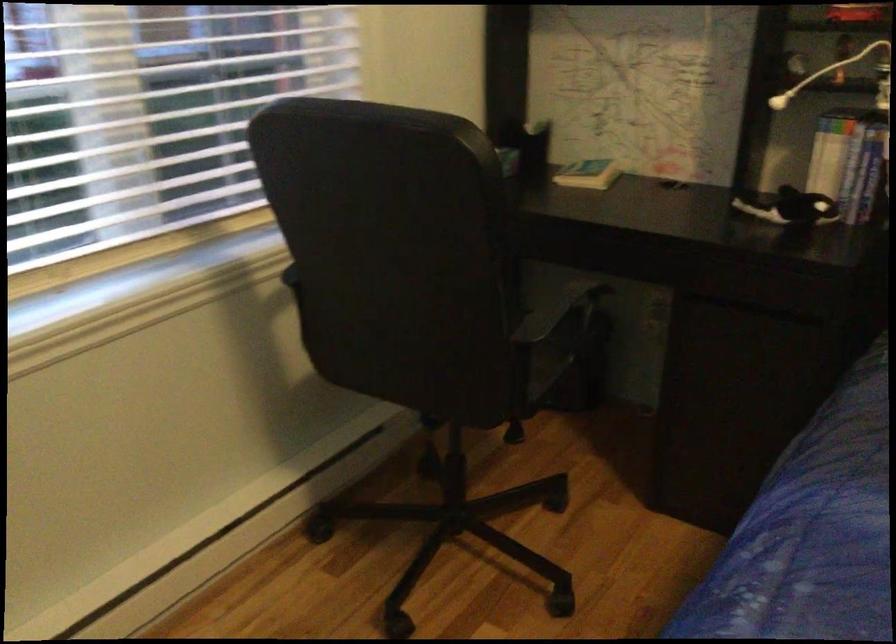
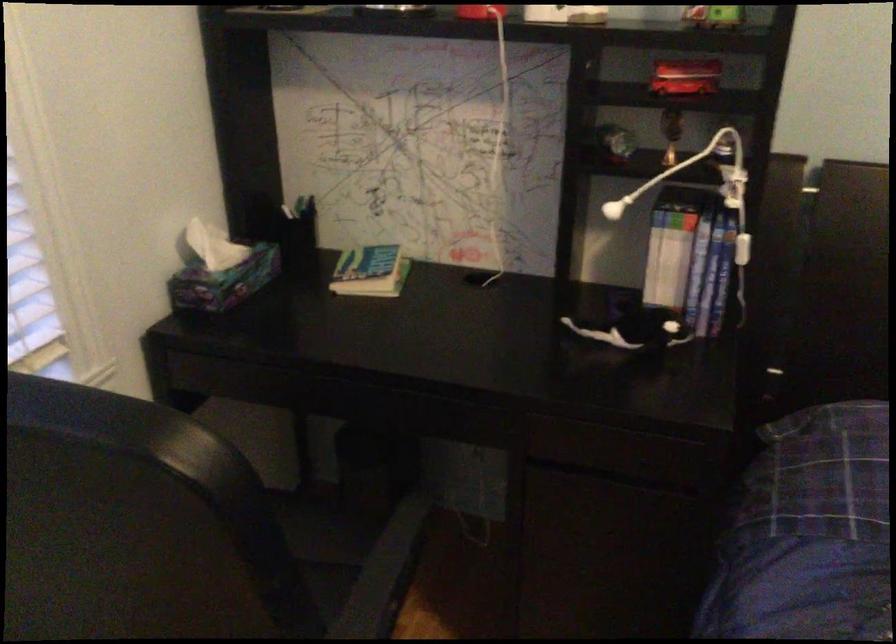
Question: The camera is either moving clockwise (left) or counter-clockwise (right) around the object. The first image is from the beginning of the video and the second image is from the end. Is the camera moving left or right when shooting the video?

Choices:
 (A) Left
 (B) Right

Answer: (A)